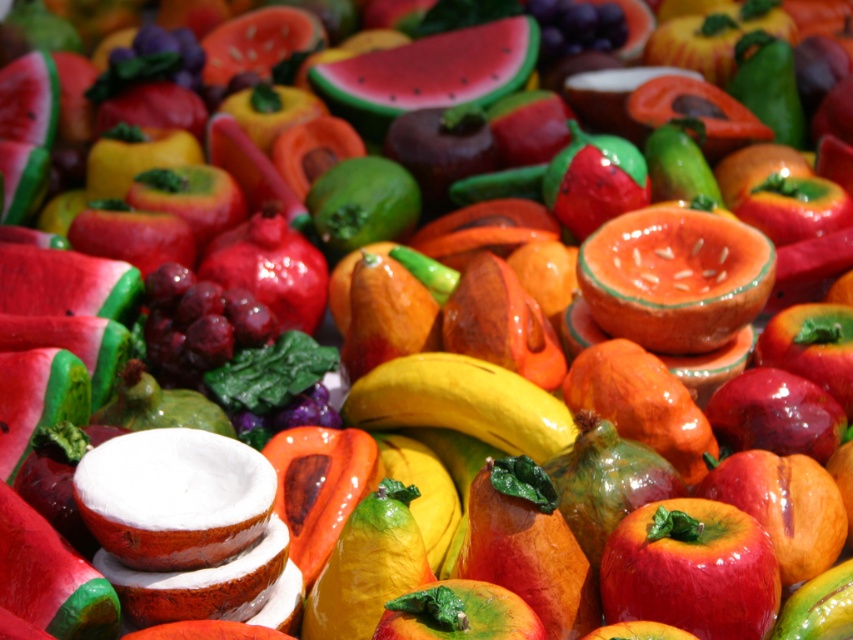
Based on the photo, you are an artist preparing to paint a still life of the shiny red apple at center and the smooth red watermelon at center. Which object should you sketch first if you want to start with the smaller one?

The shiny red apple at center has a lesser width compared to the smooth red watermelon at center, so you should sketch the shiny red apple at center first.

In the image of the colorful artificial fruit and vegetable display, you see the shiny red apple at center and the smooth red watermelon at center. Which object is located below the other?

The shiny red apple at center is positioned under the smooth red watermelon at center, so the apple is below the watermelon.

In the scene shown: You are an artist trying to paint the arrangement of the shiny red apple at center and the smooth red watermelon at center. Which fruit is positioned to the right side in the image?

The shiny red apple at center is positioned to the right of the smooth red watermelon at center.